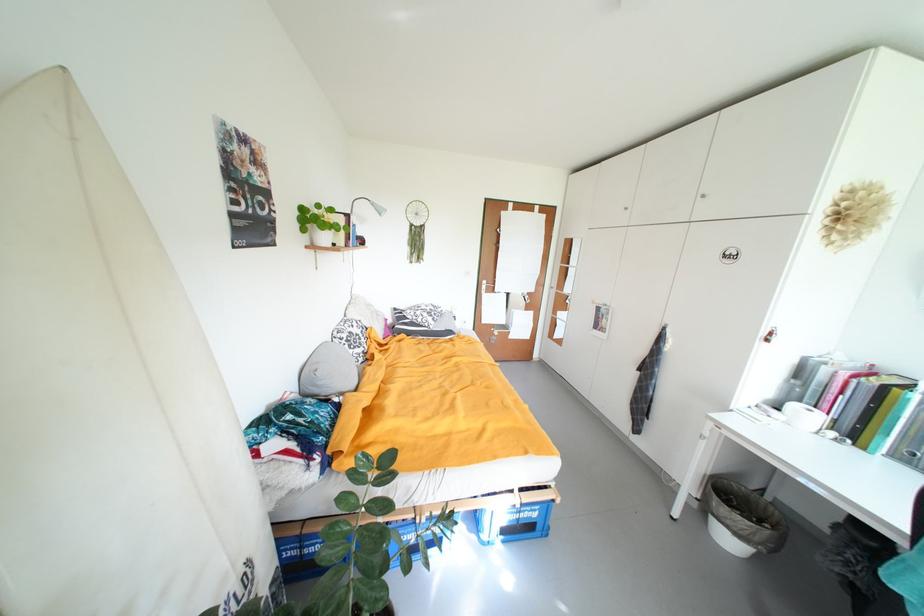
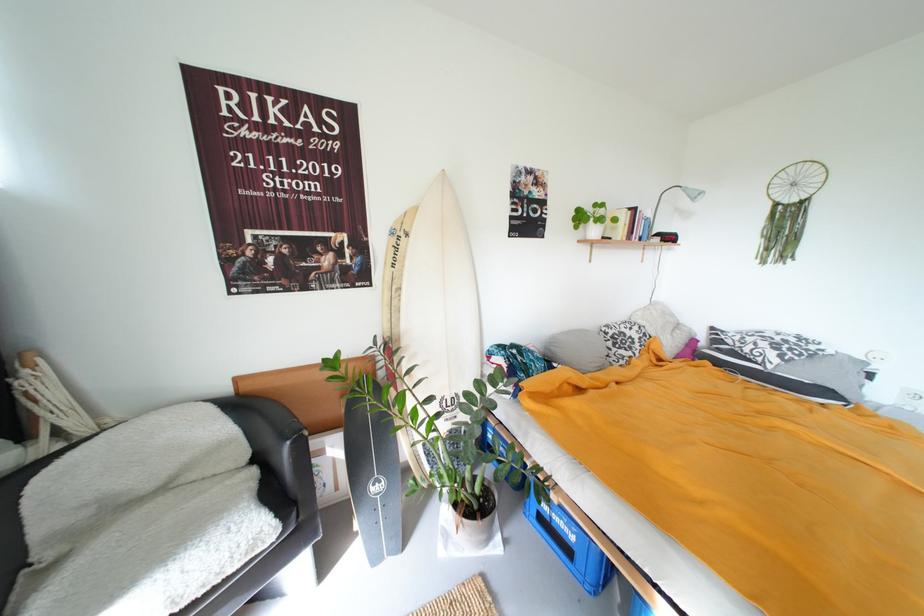
Find the pixel in the second image that matches pixel 349 341 in the first image.

(614, 334)